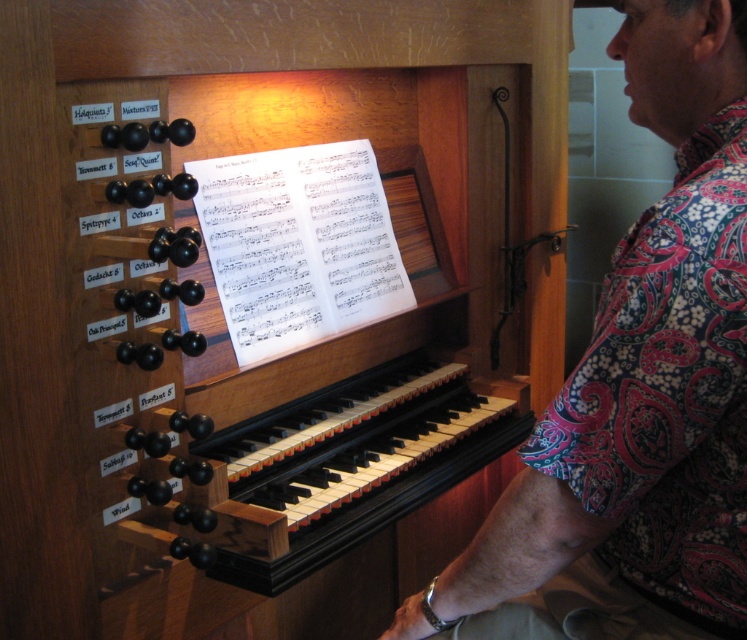
Does floral fabric shirt at right come behind black polished wood keyboard at center?

No, floral fabric shirt at right is closer to the viewer.

Is point (704, 324) closer to camera compared to point (311, 438)?

Yes, it is in front of point (311, 438).

Is point (503, 579) farther from viewer compared to point (291, 451)?

No, (503, 579) is closer to viewer.

Identify the location of floral fabric shirt at right. The height and width of the screenshot is (640, 747). (638, 392).